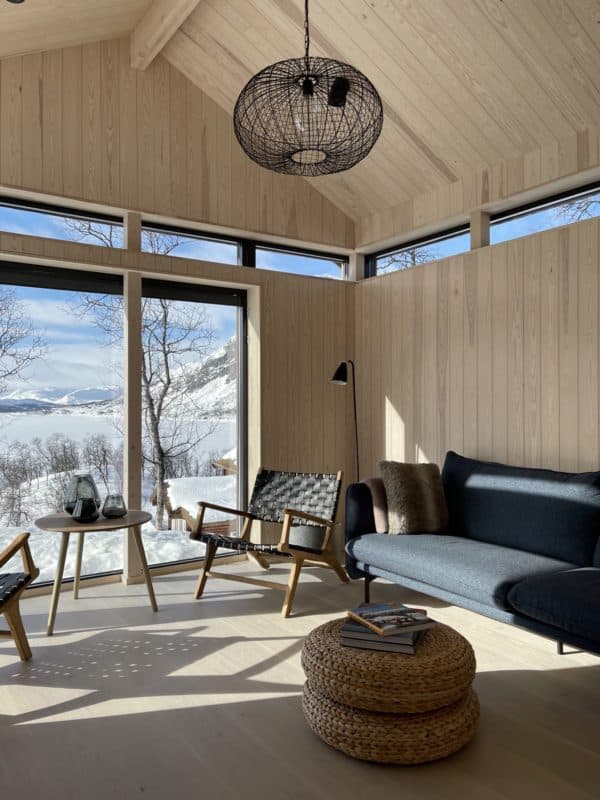
Find the location of a particular element. wicker is located at coordinates 414,698.